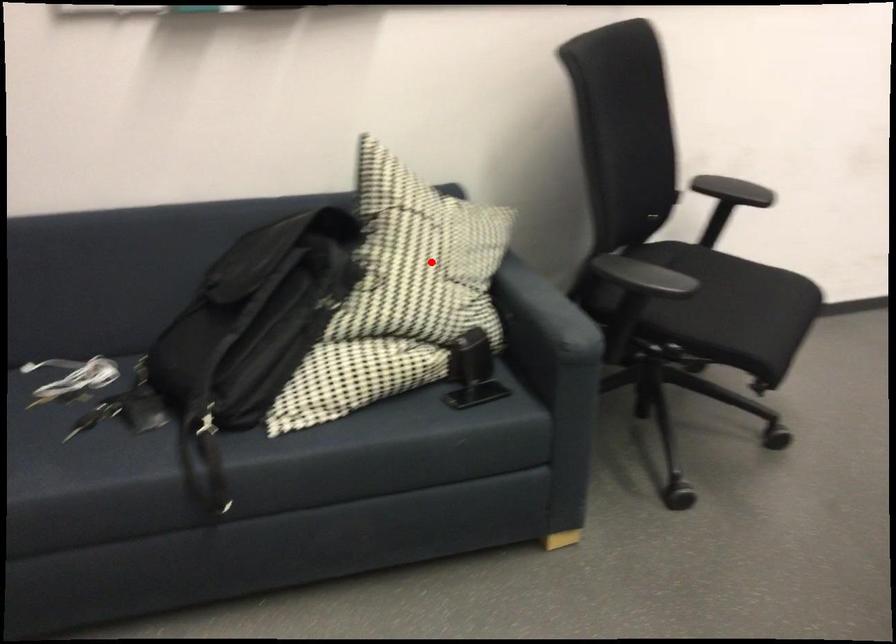
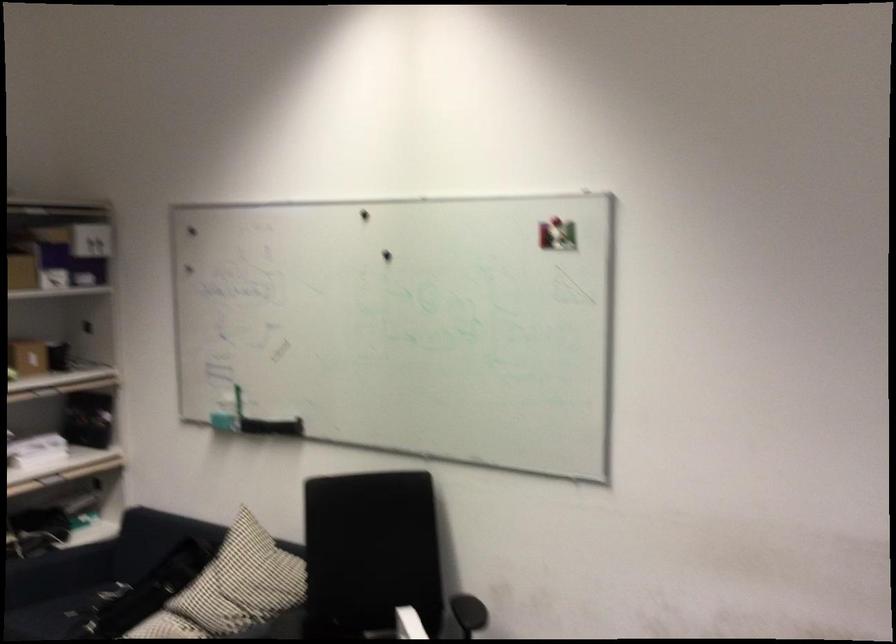
In the second image, find the point that corresponds to the highlighted location in the first image.

(231, 588)